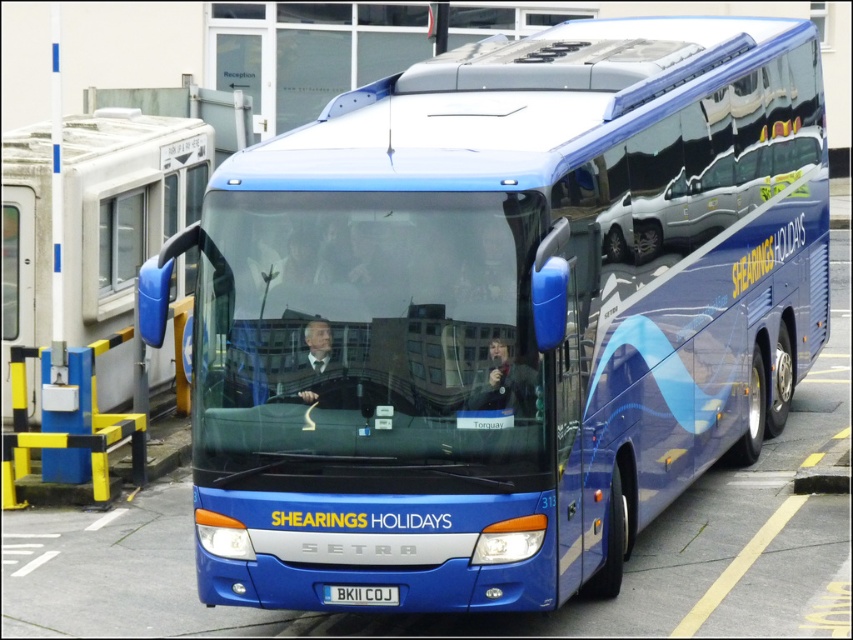
You are standing at the bus station and want to take a photo of the large blue coach bus. The bus has a license plate that reads BK11 COJ. To ensure the entire bus is in frame, you need to know how far you should stand from the bus. According to the scene description, where should you position yourself relative to the point at coordinates (322, 374) to capture the entire bus in your photo?

You should position yourself 8.21 meters away from the point at coordinates (322, 374) to ensure the entire large blue coach bus is in frame for your photo.

You are a photographer standing 5 feet away from the bus. You want to take a photo of both the smooth skin face at center and the blue metallic license plate at center without moving your position. Can you fit both into the frame if your camera has a standard 50mm lens?

The smooth skin face at center is 3.64 feet from the blue metallic license plate at center. Since the photographer is 5 feet away from the bus, the distance between the two objects is less than the camera lens range, so yes, both can be captured in the frame.